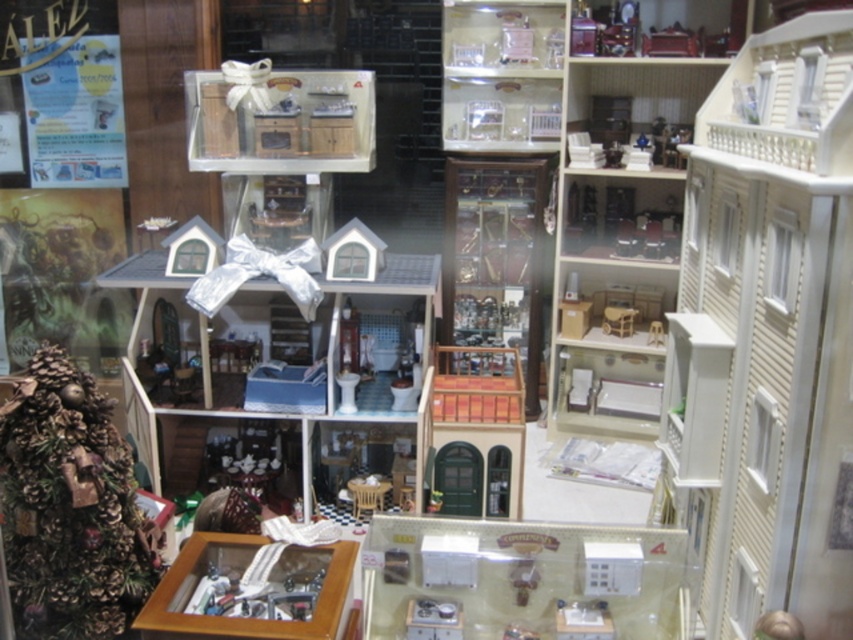
In the scene shown: Does green pinecone tree at left have a lesser height compared to wooden door at center?

No, green pinecone tree at left is not shorter than wooden door at center.

Can you confirm if green pinecone tree at left is smaller than wooden door at center?

Yes.

Is point (3, 444) more distant than point (451, 490)?

That is False.

What are the coordinates of `green pinecone tree at left` in the screenshot? It's located at (70, 508).

Does green pinecone tree at left have a greater height compared to metallic silver scale at center?

Indeed, green pinecone tree at left has a greater height compared to metallic silver scale at center.

Between green pinecone tree at left and metallic silver scale at center, which one has less height?

Standing shorter between the two is metallic silver scale at center.

Between point (50, 452) and point (426, 634), which one is positioned behind?

The point (426, 634) is more distant.

Locate an element on the screen. green pinecone tree at left is located at coordinates (70, 508).

Can you confirm if wooden door at center is positioned to the right of metallic silver scale at center?

Indeed, wooden door at center is positioned on the right side of metallic silver scale at center.

Can you confirm if wooden door at center is wider than metallic silver scale at center?

Yes.

Where is `wooden door at center`? The width and height of the screenshot is (853, 640). wooden door at center is located at coordinates (476, 429).

Where is `wooden door at center`? The height and width of the screenshot is (640, 853). wooden door at center is located at coordinates (476, 429).